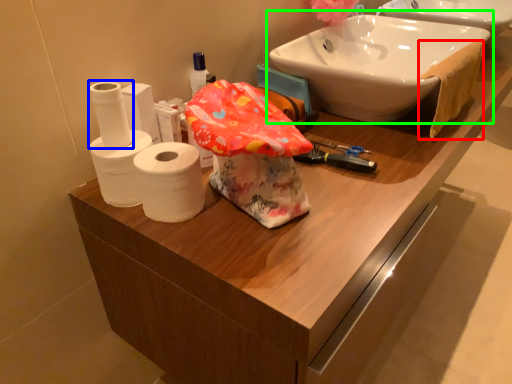
Question: Which object is positioned closest to bath towel (highlighted by a red box)? Select from toilet paper (highlighted by a blue box) and sink (highlighted by a green box).

Choices:
 (A) toilet paper
 (B) sink

Answer: (B)